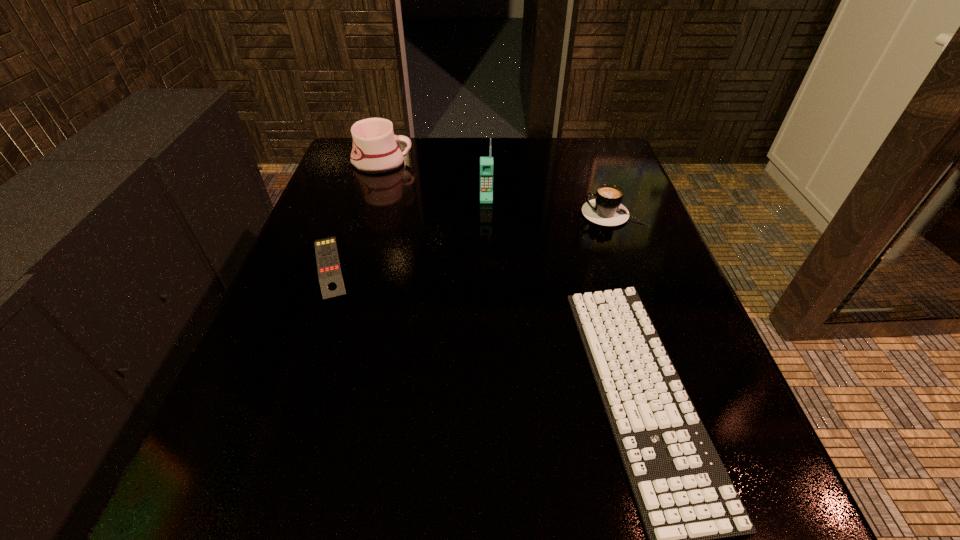
The height and width of the screenshot is (540, 960). I want to click on vacant space at the near left corner of the desktop, so click(299, 522).

Identify the location of vacant space at the far right corner. This screenshot has height=540, width=960. (561, 150).

Find the location of a particular element. empty space between the third shortest object and the remote control is located at coordinates (471, 240).

This screenshot has height=540, width=960. I want to click on unoccupied position between the third shortest object and the farthest object, so click(x=498, y=188).

Where is `vacant region between the fourth shortest object and the third tallest object`? Image resolution: width=960 pixels, height=540 pixels. vacant region between the fourth shortest object and the third tallest object is located at coordinates (498, 188).

The height and width of the screenshot is (540, 960). I want to click on vacant space that is in between the third shortest object and the remote control, so click(471, 240).

Locate an element on the screen. This screenshot has width=960, height=540. free space between the cellular telephone and the remote control is located at coordinates (408, 232).

Identify the location of unoccupied area between the third shortest object and the remote control. This screenshot has width=960, height=540. 471,240.

The width and height of the screenshot is (960, 540). What are the coordinates of `free space between the fourth shortest object and the remote control` in the screenshot? It's located at (356, 214).

Locate which object ranks fourth in proximity to the farthest object. Please provide its 2D coordinates. Your answer should be formatted as a tuple, i.e. [(x, y)], where the tuple contains the x and y coordinates of a point satisfying the conditions above.

[(691, 511)]